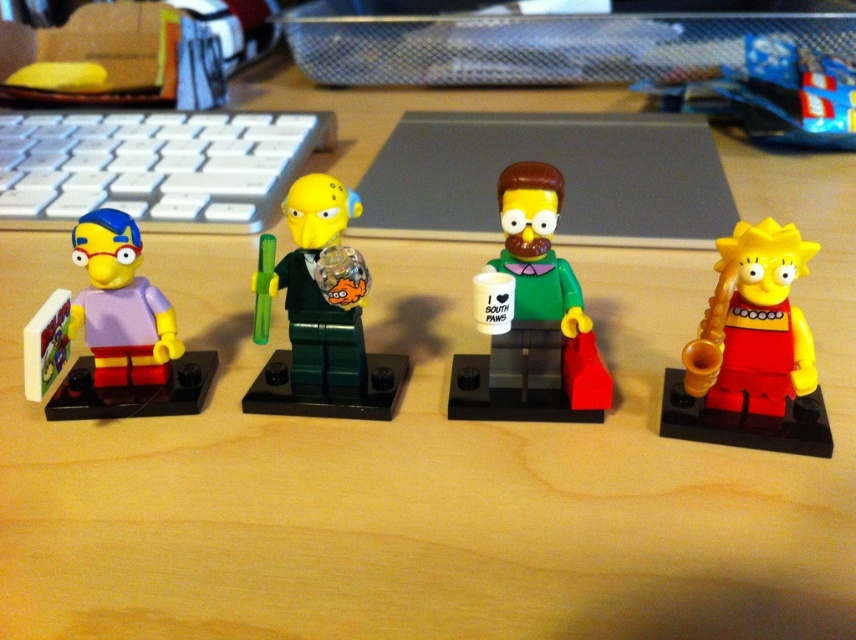
You are organizing a toy store shelf and need to place the matte purple plastic toy at left and the blue plastic bag at upper center. According to the image, which object is closer to the front of the shelf?

The matte purple plastic toy at left is closer to the front of the shelf because it is in front of the blue plastic bag at upper center.

Which direction is the green matte figure at center facing compared to the other minifigures?

The green matte figure at center is facing the same direction as the other minifigures since they are all arranged side by side.